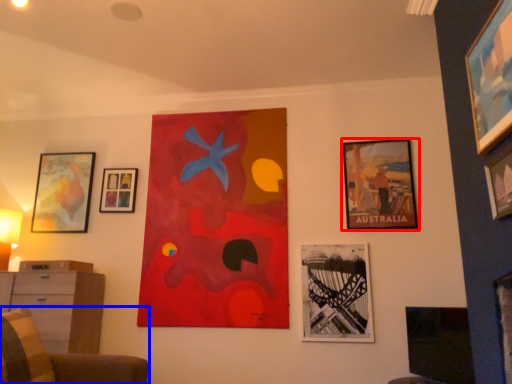
Question: Which object appears farthest to the camera in this image, picture frame (highlighted by a red box) or furniture (highlighted by a blue box)?

Choices:
 (A) picture frame
 (B) furniture

Answer: (A)